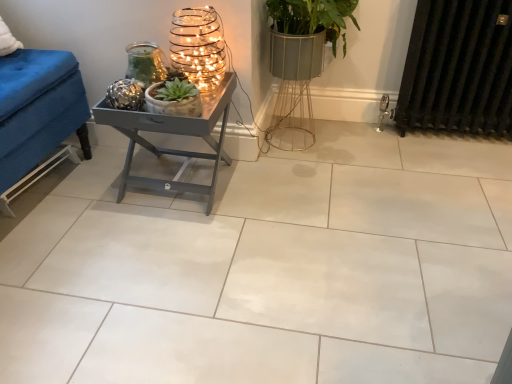
Image resolution: width=512 pixels, height=384 pixels. Find the location of `free point below metallic gray table at center (from a real-world perspective)`. free point below metallic gray table at center (from a real-world perspective) is located at coordinates (180, 179).